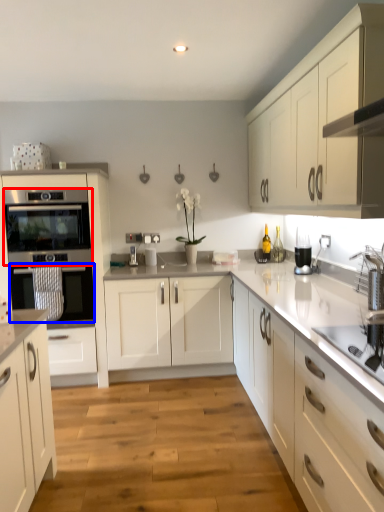
Question: Among these objects, which one is farthest to the camera, oven (highlighted by a red box) or oven (highlighted by a blue box)?

Choices:
 (A) oven
 (B) oven

Answer: (B)